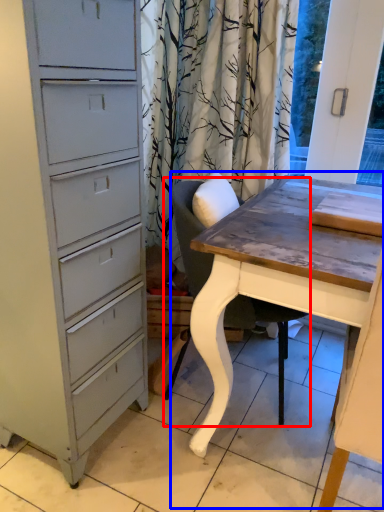
Question: Which point is further to the camera, chair (highlighted by a red box) or table (highlighted by a blue box)?

Choices:
 (A) chair
 (B) table

Answer: (A)